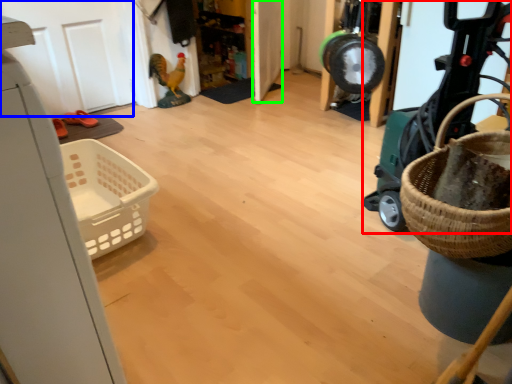
Question: Which is farther away from baby carriage (highlighted by a red box)? door (highlighted by a blue box) or door (highlighted by a green box)?

Choices:
 (A) door
 (B) door

Answer: (A)